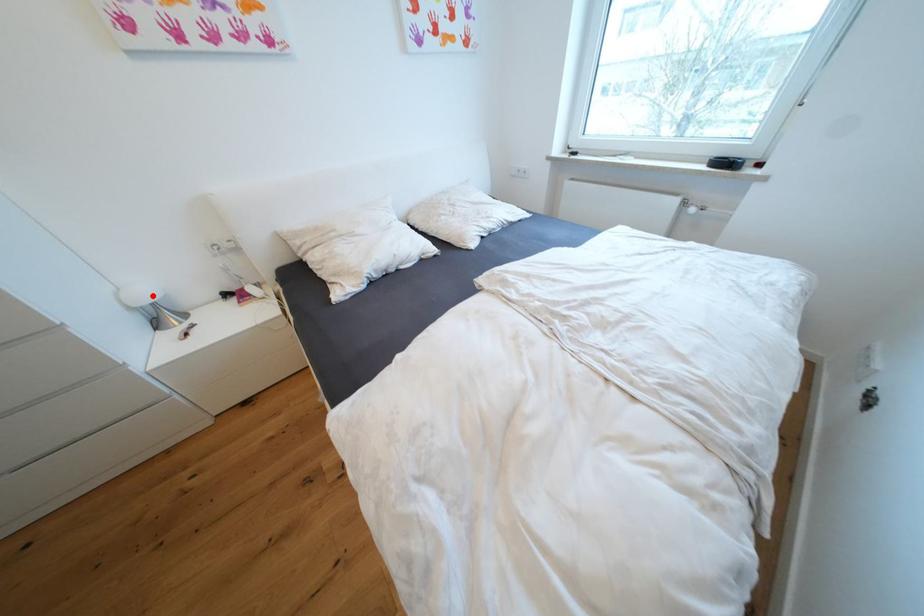
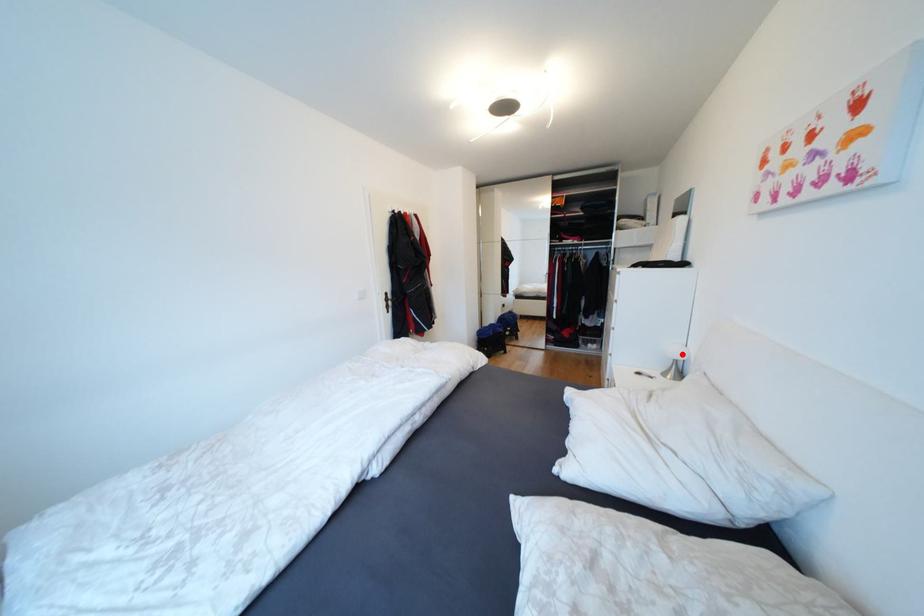
I am providing you with two images of the same scene from different viewpoints. A red point is marked on the first image and another point is marked on the second image. Do the highlighted points in image1 and image2 indicate the same real-world spot?

Yes